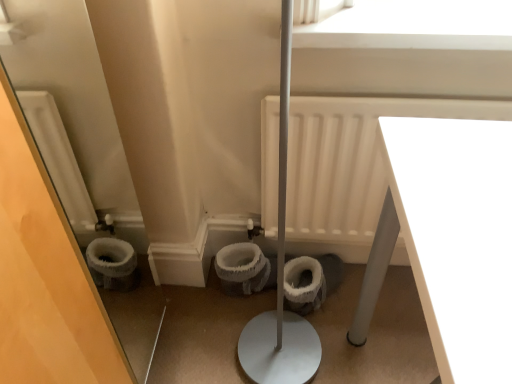
Where is `blank space situated above white matte radiator at center (from a real-world perspective)`? The image size is (512, 384). blank space situated above white matte radiator at center (from a real-world perspective) is located at coordinates (353, 94).